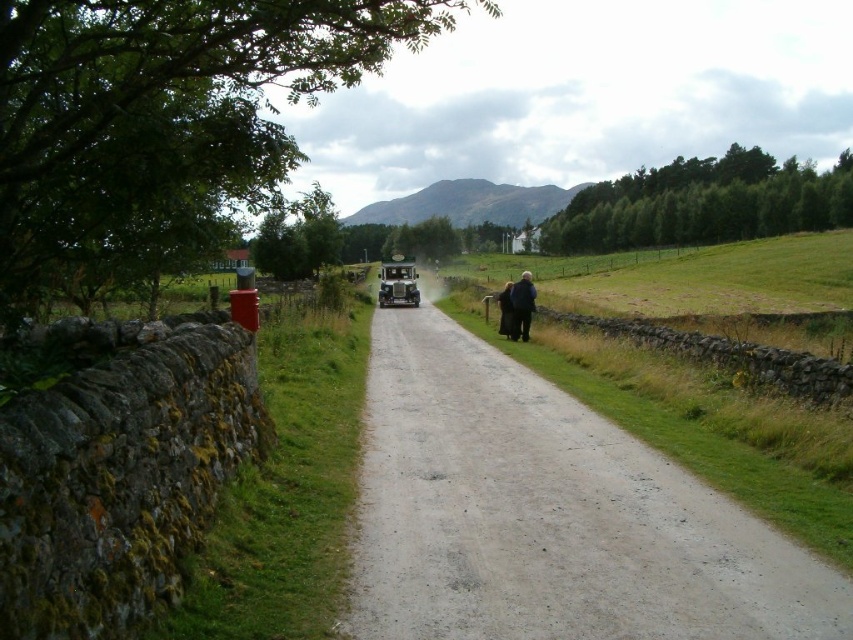
Does dusty gravel road at center have a larger size compared to dark brown wool coat at right?

Yes, dusty gravel road at center is bigger than dark brown wool coat at right.

Can you confirm if dusty gravel road at center is taller than dark brown wool coat at right?

Incorrect, dusty gravel road at center's height is not larger of dark brown wool coat at right's.

This screenshot has height=640, width=853. What do you see at coordinates (548, 515) in the screenshot?
I see `dusty gravel road at center` at bounding box center [548, 515].

At what (x,y) coordinates should I click in order to perform the action: click on dusty gravel road at center. Please return your answer as a coordinate pair (x, y). The image size is (853, 640). Looking at the image, I should click on (548, 515).

Can you confirm if dusty gravel road at center is positioned above black wool coat at right?

No.

Can you confirm if dusty gravel road at center is bigger than black wool coat at right?

No, dusty gravel road at center is not bigger than black wool coat at right.

Who is more forward, (492, 416) or (521, 275)?

Point (492, 416) is in front.

At what (x,y) coordinates should I click in order to perform the action: click on dusty gravel road at center. Please return your answer as a coordinate pair (x, y). The height and width of the screenshot is (640, 853). Looking at the image, I should click on (x=548, y=515).

Identify the location of black wool coat at right. The width and height of the screenshot is (853, 640). (515, 307).

Is black wool coat at right positioned in front of dark brown wool coat at right?

Yes, black wool coat at right is closer to the viewer.

Between point (523, 312) and point (506, 285), which one is positioned behind?

The point (506, 285) is more distant.

Identify the location of black wool coat at right. Image resolution: width=853 pixels, height=640 pixels. [x=515, y=307].